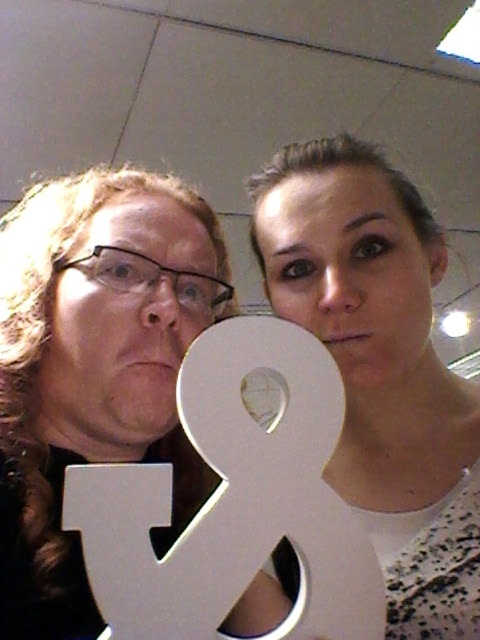
Question: Which point is farther to the camera?

Choices:
 (A) metallic gold number at center
 (B) white matte letter at center
 (C) white matte sign at center

Answer: (C)

Question: Which of the following is the closest to the observer?

Choices:
 (A) (417, 561)
 (B) (17, 577)
 (C) (203, 426)

Answer: (C)

Question: Can you confirm if white matte sign at center is bigger than white matte letter at center?

Choices:
 (A) yes
 (B) no

Answer: (A)

Question: Is metallic gold number at center positioned in front of white matte sign at center?

Choices:
 (A) yes
 (B) no

Answer: (A)

Question: Is metallic gold number at center to the left of white matte sign at center from the viewer's perspective?

Choices:
 (A) yes
 (B) no

Answer: (A)

Question: Which object is the farthest from the metallic gold number at center?

Choices:
 (A) white matte letter at center
 (B) white matte sign at center

Answer: (A)